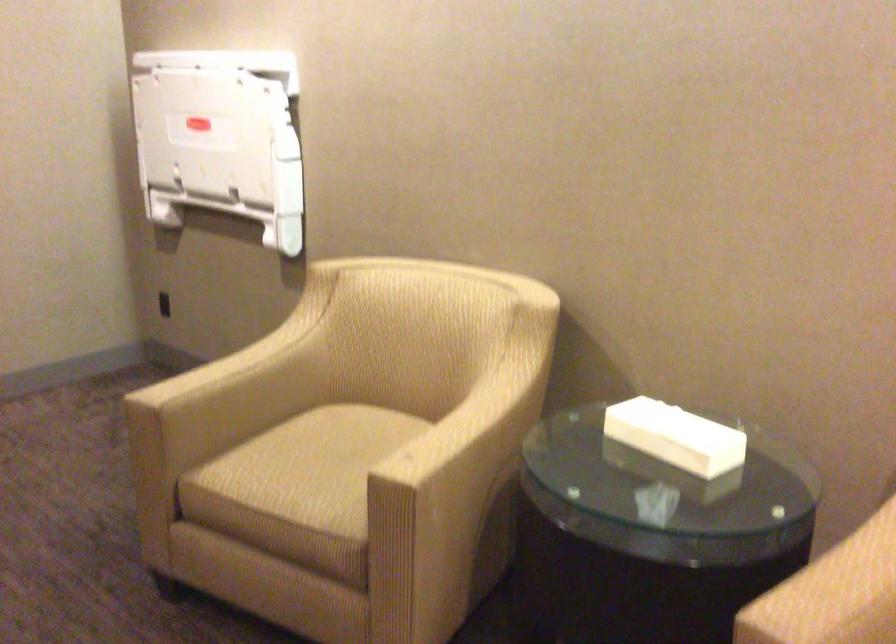
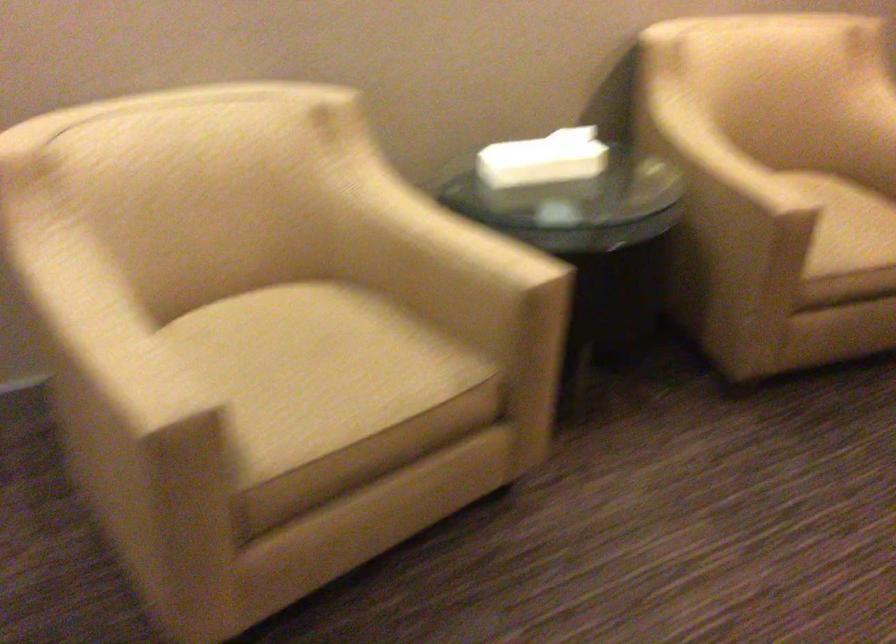
Find the pixel in the second image that matches (652,428) in the first image.

(543, 158)